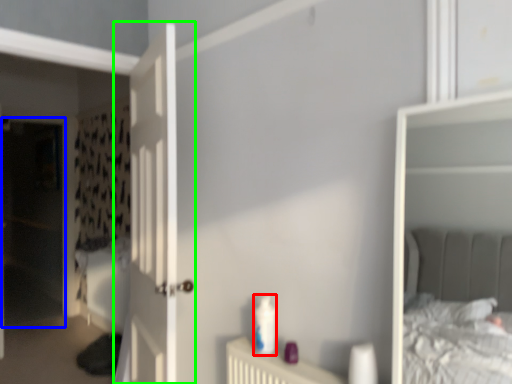
Question: Estimate the real-world distances between objects in this image. Which object is farther from toiletry (highlighted by a red box), screen door (highlighted by a blue box) or door (highlighted by a green box)?

Choices:
 (A) screen door
 (B) door

Answer: (A)